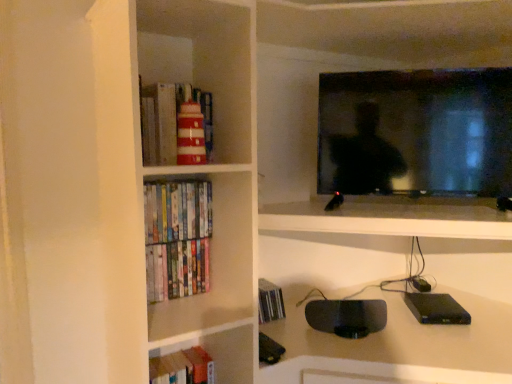
Question: Does hardcover books at left have a lesser width compared to black glossy tv at upper right?

Choices:
 (A) yes
 (B) no

Answer: (A)

Question: Is hardcover books at left placed right next to black glossy tv at upper right?

Choices:
 (A) yes
 (B) no

Answer: (B)

Question: From a real-world perspective, is hardcover books at left positioned over black glossy tv at upper right based on gravity?

Choices:
 (A) no
 (B) yes

Answer: (A)

Question: From the image's perspective, would you say hardcover books at left is shown under black glossy tv at upper right?

Choices:
 (A) no
 (B) yes

Answer: (B)

Question: From the image's perspective, does hardcover books at left appear higher than black glossy tv at upper right?

Choices:
 (A) yes
 (B) no

Answer: (B)

Question: In the image, is hardcover books at left on the left side or the right side of hardcover books at lower left?

Choices:
 (A) right
 (B) left

Answer: (B)

Question: From a real-world perspective, is hardcover books at left above or below hardcover books at lower left?

Choices:
 (A) above
 (B) below

Answer: (A)

Question: From their relative heights in the image, would you say hardcover books at left is taller or shorter than hardcover books at lower left?

Choices:
 (A) short
 (B) tall

Answer: (A)

Question: From the image's perspective, is hardcover books at left above or below hardcover books at lower left?

Choices:
 (A) below
 (B) above

Answer: (B)

Question: In terms of size, does hardcover books at lower left appear bigger or smaller than black glossy tv at upper right?

Choices:
 (A) big
 (B) small

Answer: (B)

Question: Considering the positions of hardcover books at lower left and black glossy tv at upper right in the image, is hardcover books at lower left wider or thinner than black glossy tv at upper right?

Choices:
 (A) wide
 (B) thin

Answer: (B)

Question: Is hardcover books at lower left inside or outside of black glossy tv at upper right?

Choices:
 (A) outside
 (B) inside

Answer: (A)

Question: Would you say hardcover books at lower left is to the left or to the right of black glossy tv at upper right in the picture?

Choices:
 (A) right
 (B) left

Answer: (B)

Question: Is hardcover books at lower left bigger or smaller than hardcover books at left?

Choices:
 (A) big
 (B) small

Answer: (A)

Question: Is point (232, 375) positioned closer to the camera than point (169, 266)?

Choices:
 (A) farther
 (B) closer

Answer: (B)